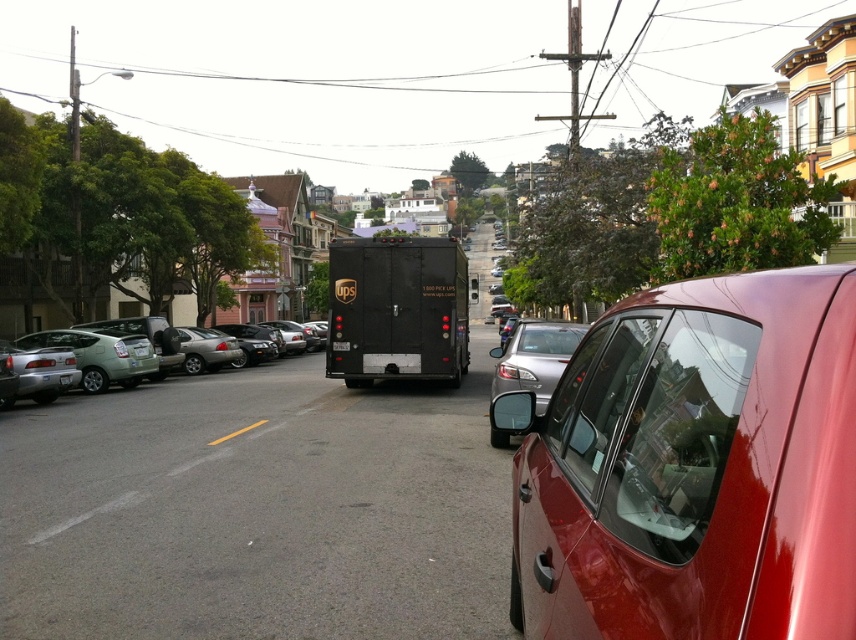
Question: Is black matte license plate at center to the left of green matte license plate at center from the viewer's perspective?

Choices:
 (A) no
 (B) yes

Answer: (B)

Question: Is matte black car at left smaller than green matte license plate at center?

Choices:
 (A) yes
 (B) no

Answer: (B)

Question: Which of the following is the closest to the observer?

Choices:
 (A) matte black car at left
 (B) green matte license plate at center
 (C) satin silver sedan at center

Answer: (C)

Question: Based on their relative distances, which object is nearer to the matte black car at left?

Choices:
 (A) satin silver sedan at center
 (B) glossy red car at right
 (C) black matte license plate at center

Answer: (C)

Question: Based on their relative distances, which object is nearer to the glossy red car at right?

Choices:
 (A) satin silver sedan at center
 (B) green matte license plate at center
 (C) black matte license plate at center

Answer: (A)

Question: Can you confirm if glossy red car at right is wider than matte black car at left?

Choices:
 (A) yes
 (B) no

Answer: (B)